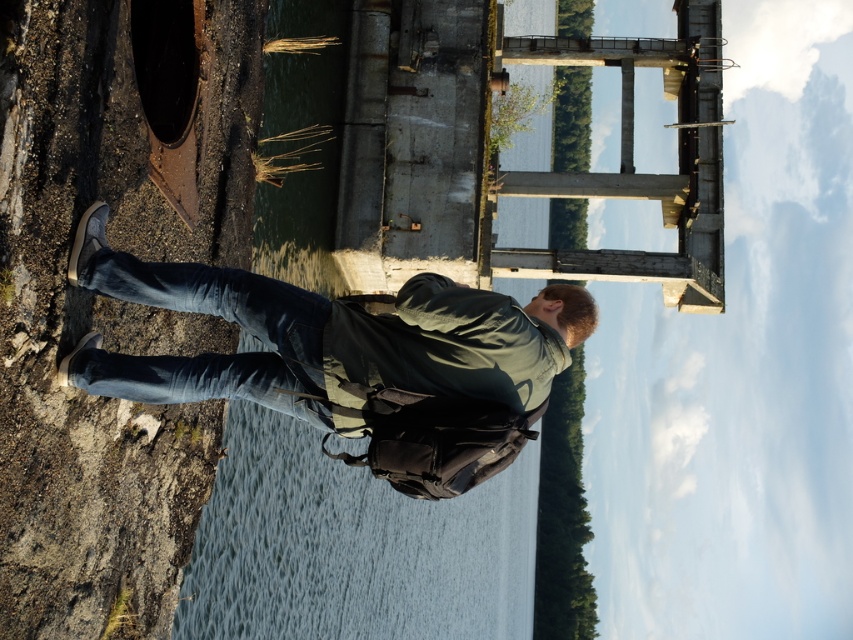
You are a hiker who wants to take a photo of the denim jacket at center and the rusty metal cliff at lower left. Which object should you frame first in your camera to capture both in the same shot?

The rusty metal cliff at lower left is positioned on the left side of denim jacket at center, so you should frame the rusty metal cliff at lower left first and then include the denim jacket at center to the right of it in the same shot.

Looking at this image, you are a hiker who wants to cross from the rusty metal cliff at lower left to the denim jacket at center. Given that your maximum safe distance for a jump is 10 feet, can you safely make the jump?

The distance between the rusty metal cliff at lower left and the denim jacket at center is 10.27 feet, which exceeds your maximum safe jump distance of 10 feet. Therefore, it is not safe to attempt the jump.